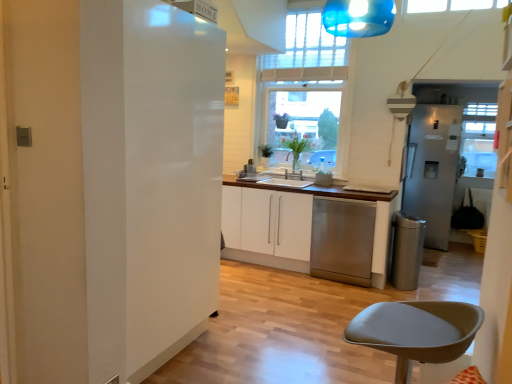
Question: Considering the positions of satin silver refrigerator at right, the 2th fridge in the front-to-back sequence, and white glossy cabinet at center in the image, is satin silver refrigerator at right, the 2th fridge in the front-to-back sequence, bigger or smaller than white glossy cabinet at center?

Choices:
 (A) small
 (B) big

Answer: (B)

Question: Do you think satin silver refrigerator at right, the first fridge from the right, is within white glossy cabinet at center, or outside of it?

Choices:
 (A) inside
 (B) outside

Answer: (B)

Question: Estimate the real-world distances between objects in this image. Which object is closer to the matte gray stool at lower right?

Choices:
 (A) stainless steel trash can at lower right
 (B) stainless steel dishwasher at center
 (C) clear glass window at center
 (D) satin silver refrigerator at right, the first fridge from the right
 (E) white glossy refrigerator at left, placed as the 1th fridge when sorted from left to right

Answer: (E)

Question: Which of these objects is positioned farthest from the stainless steel trash can at lower right?

Choices:
 (A) clear glass window at center
 (B) matte gray stool at lower right
 (C) satin silver refrigerator at right, which appears as the 1th fridge when viewed from the back
 (D) white glossy cabinet at center
 (E) white glossy refrigerator at left, which is counted as the 2th fridge, starting from the back

Answer: (B)